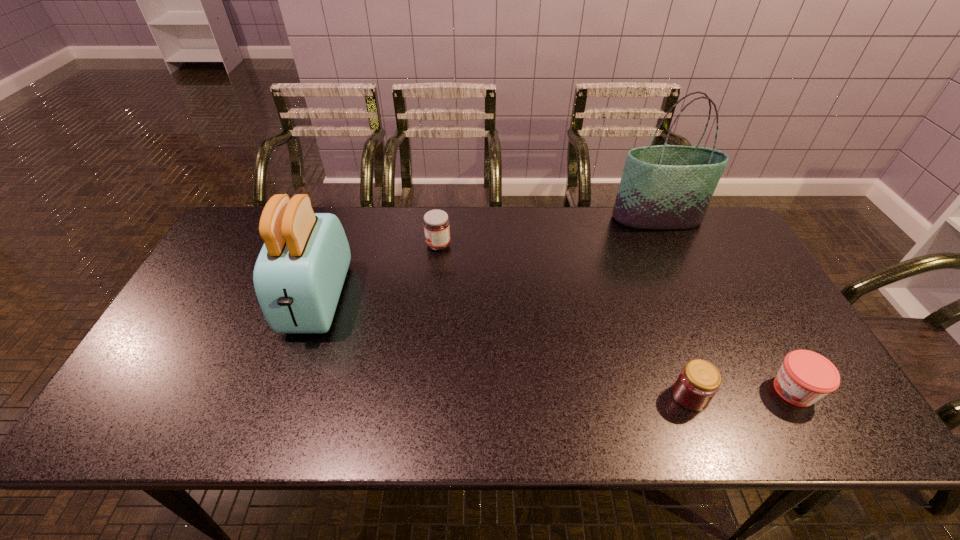
The height and width of the screenshot is (540, 960). I want to click on free spot between the farthest jam and the second jam from left to right, so click(x=564, y=320).

Where is `free space between the tallest jam and the third farthest object`? This screenshot has width=960, height=540. free space between the tallest jam and the third farthest object is located at coordinates (377, 272).

Find the location of a particular element. The height and width of the screenshot is (540, 960). unoccupied area between the rightmost jam and the second object from left to right is located at coordinates [x=616, y=318].

I want to click on free spot between the second jam from right to left and the third shortest object, so click(564, 320).

Locate an element on the screen. vacant area that lies between the rightmost jam and the second object from left to right is located at coordinates point(616,318).

In order to click on the third closest object to the toaster in this screenshot , I will do [x=665, y=187].

What are the coordinates of `the closest object to the farthest object` in the screenshot? It's located at (804, 377).

This screenshot has height=540, width=960. I want to click on the closest jam to the tote bag, so click(804, 377).

Select which jam is the second closest to the rightmost jam. Please provide its 2D coordinates. Your answer should be formatted as a tuple, i.e. [(x, y)], where the tuple contains the x and y coordinates of a point satisfying the conditions above.

[(436, 223)]

Locate an element on the screen. This screenshot has width=960, height=540. free space that satisfies the following two spatial constraints: 1. on the front label of the rightmost jam; 2. on the front side of the second jam from right to left is located at coordinates (797, 395).